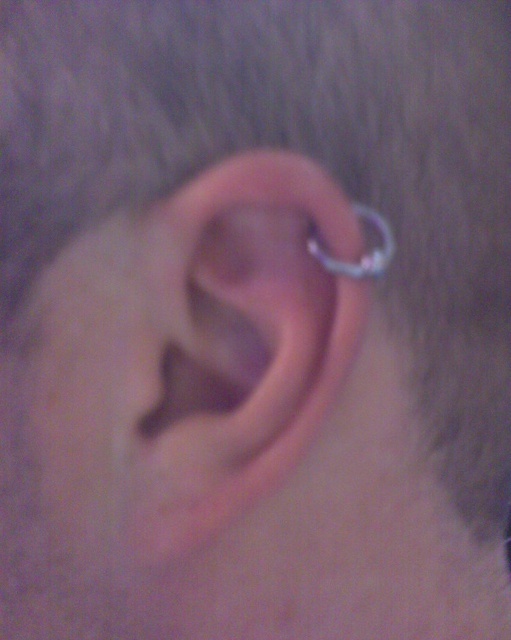
Question: Can you confirm if pink flesh-colored ear at center is positioned below silver metallic hoop at ear?

Choices:
 (A) yes
 (B) no

Answer: (A)

Question: Which object is farther from the camera taking this photo?

Choices:
 (A) silver metallic hoop at ear
 (B) pink flesh-colored ear at center

Answer: (A)

Question: Which point is farther to the camera?

Choices:
 (A) silver metallic hoop at ear
 (B) pink flesh-colored ear at center

Answer: (A)

Question: Can you confirm if pink flesh-colored ear at center is wider than silver metallic hoop at ear?

Choices:
 (A) yes
 (B) no

Answer: (A)

Question: Can you confirm if pink flesh-colored ear at center is positioned to the left of silver metallic hoop at ear?

Choices:
 (A) yes
 (B) no

Answer: (A)